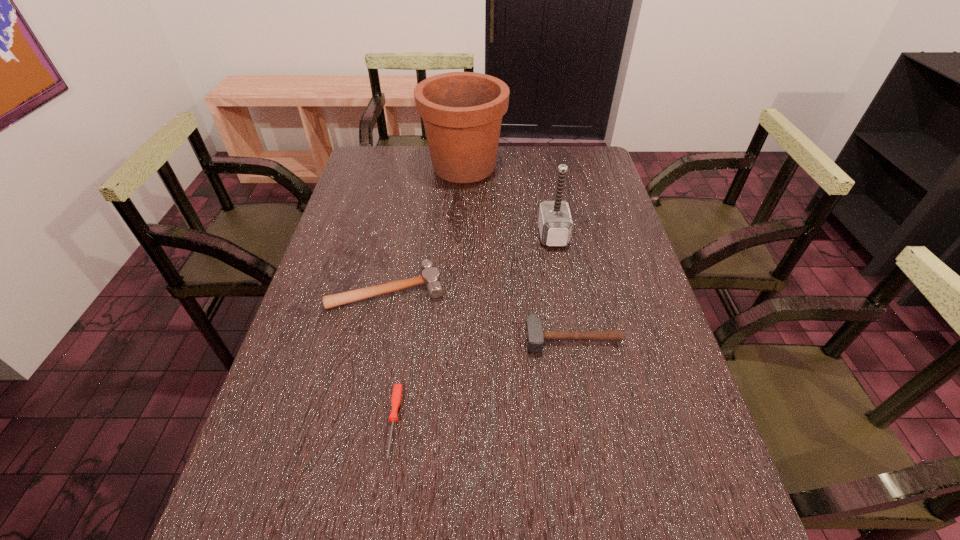
At what (x,y) coordinates should I click in order to perform the action: click on the farthest object. Please return your answer as a coordinate pair (x, y). The image size is (960, 540). Looking at the image, I should click on click(x=462, y=112).

Image resolution: width=960 pixels, height=540 pixels. In order to click on flowerpot in this screenshot , I will do click(462, 112).

This screenshot has height=540, width=960. Identify the location of the tallest hammer. (555, 223).

You are a GUI agent. You are given a task and a screenshot of the screen. Output one action in this format:
    pyautogui.click(x=<x>, y=<y>)
    Task: Click on the second farthest object
    This screenshot has width=960, height=540.
    Given the screenshot: What is the action you would take?
    pyautogui.click(x=555, y=223)

Locate an element on the screen. The height and width of the screenshot is (540, 960). the leftmost hammer is located at coordinates (430, 277).

The height and width of the screenshot is (540, 960). In order to click on the third nearest object in this screenshot , I will do `click(430, 277)`.

The image size is (960, 540). Identify the location of the fourth farthest object. (535, 336).

Identify the location of the shortest object. Image resolution: width=960 pixels, height=540 pixels. (396, 397).

At what (x,y) coordinates should I click in order to perform the action: click on screwdriver. Please return your answer as a coordinate pair (x, y). This screenshot has height=540, width=960. Looking at the image, I should click on (396, 397).

Identify the location of free space located 0.380m on the front of the tallest object. Image resolution: width=960 pixels, height=540 pixels. (459, 265).